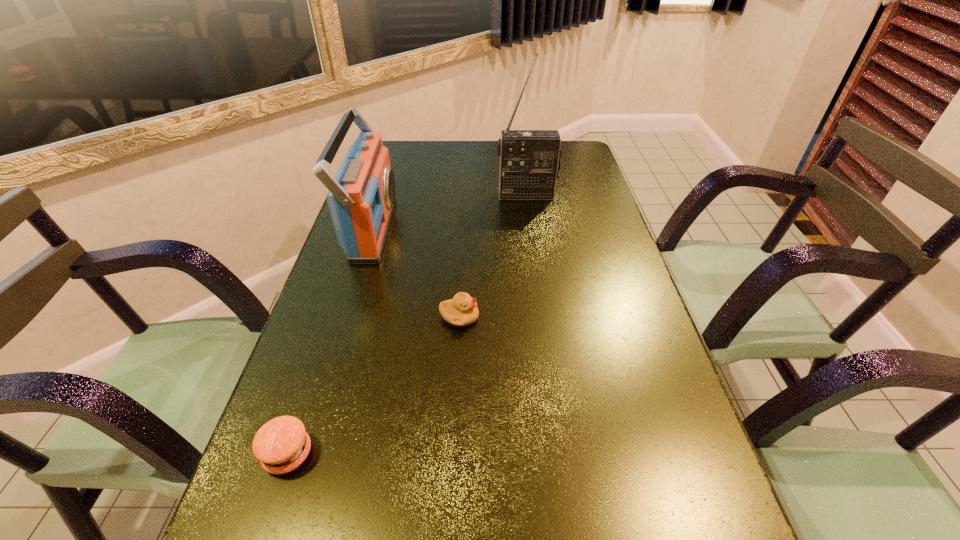
Where is `vacant region located 0.300m on the right of the nearest object`? This screenshot has height=540, width=960. vacant region located 0.300m on the right of the nearest object is located at coordinates (491, 454).

Where is `radio receiver that is at the left edge`? radio receiver that is at the left edge is located at coordinates (361, 197).

I want to click on patty located in the left edge section of the desktop, so click(281, 445).

The image size is (960, 540). What are the coordinates of `object situated at the right edge` in the screenshot? It's located at (530, 161).

In order to click on vacant space at the far edge of the desktop in this screenshot , I will do pyautogui.click(x=462, y=150).

This screenshot has width=960, height=540. In order to click on free space at the left edge in this screenshot , I will do `click(403, 213)`.

Locate an element on the screen. This screenshot has width=960, height=540. vacant space at the right edge of the desktop is located at coordinates (575, 290).

The width and height of the screenshot is (960, 540). I want to click on free space at the far left corner, so 392,142.

Locate an element on the screen. empty location between the second nearest object and the nearest object is located at coordinates (373, 386).

Locate an element on the screen. empty location between the right radio receiver and the patty is located at coordinates (407, 325).